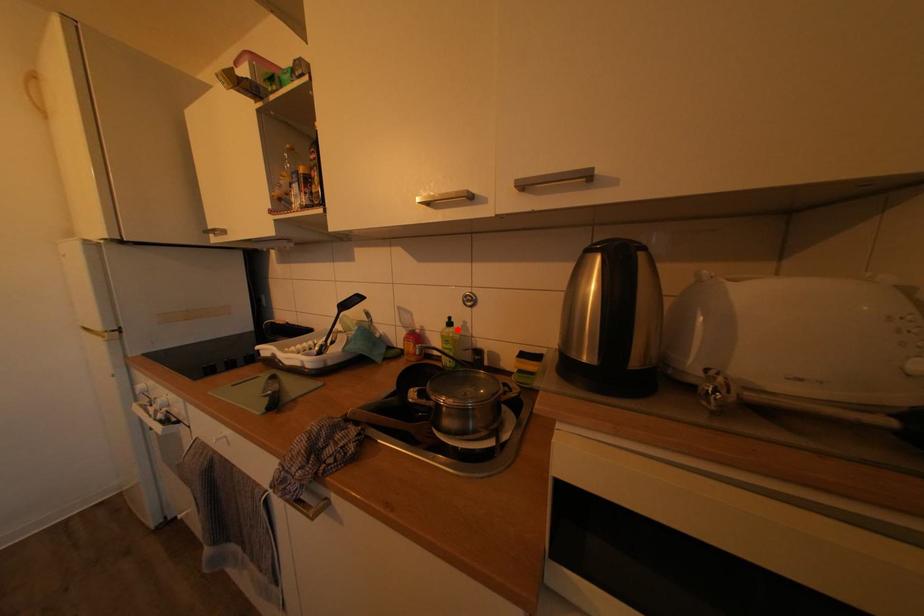
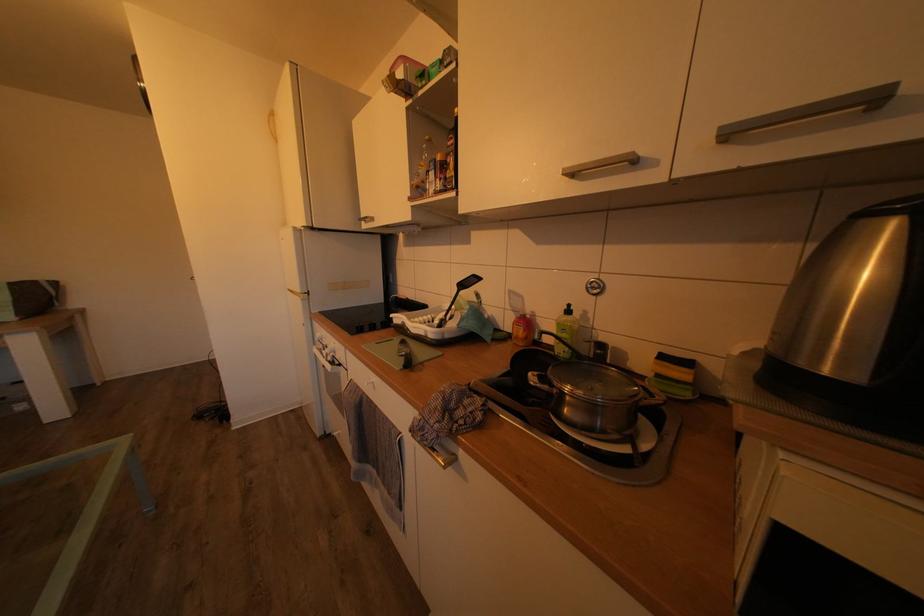
In the second image, find the point that corresponds to the highlighted location in the first image.

(577, 317)